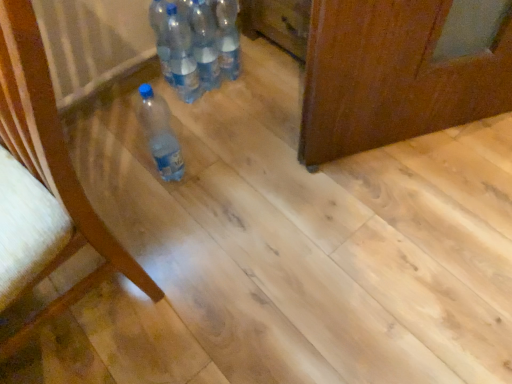
The image size is (512, 384). Find the location of `free location in front of clear plastic bottle at center, the 3th bottle viewed from the top`. free location in front of clear plastic bottle at center, the 3th bottle viewed from the top is located at coordinates (200, 135).